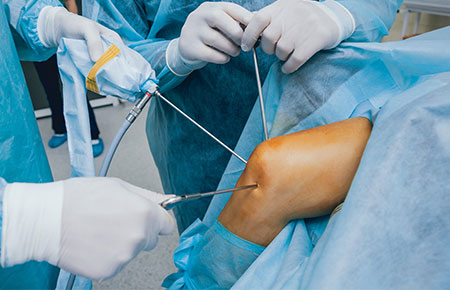
Where is `white floor`? white floor is located at coordinates (129, 165).